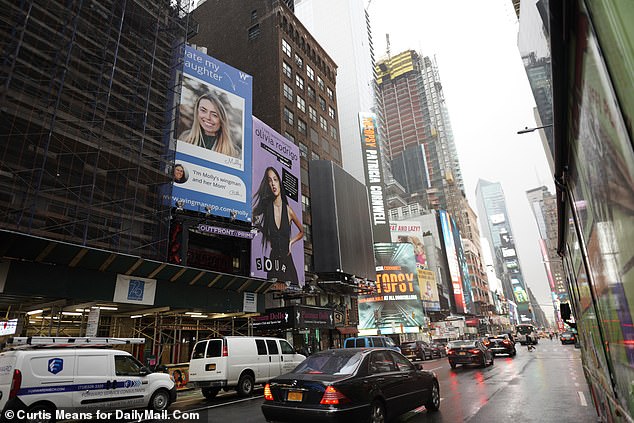
Identify the location of ladder. (51, 337).